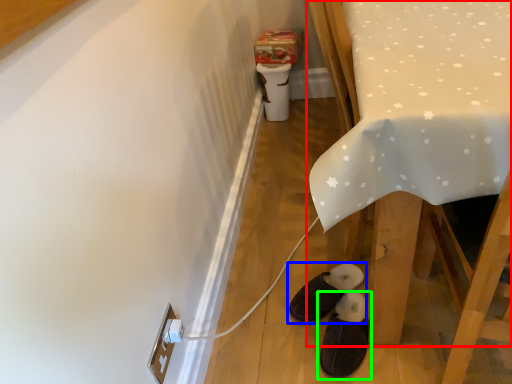
Question: Considering the real-world distances, which object is farthest from furniture (highlighted by a red box)? footwear (highlighted by a blue box) or footwear (highlighted by a green box)?

Choices:
 (A) footwear
 (B) footwear

Answer: (A)